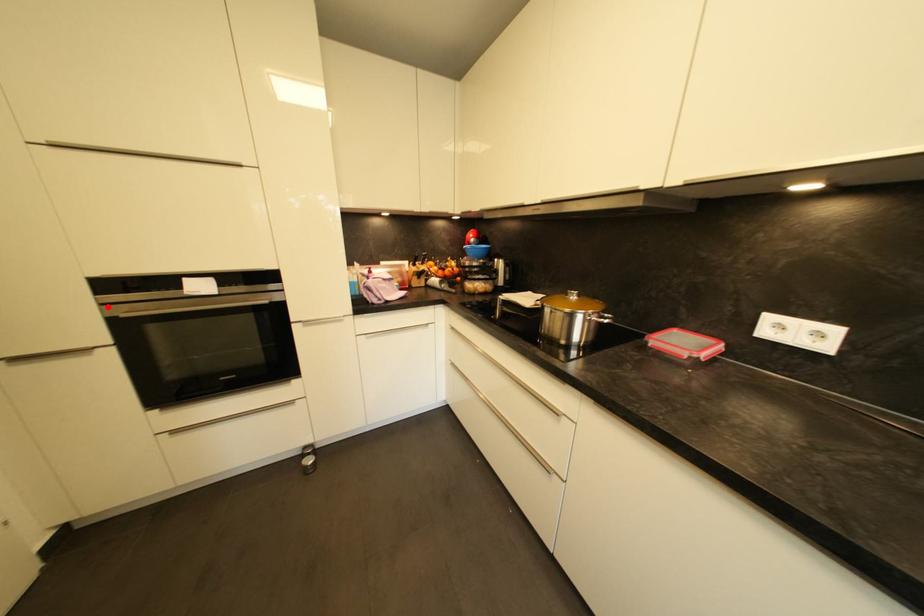
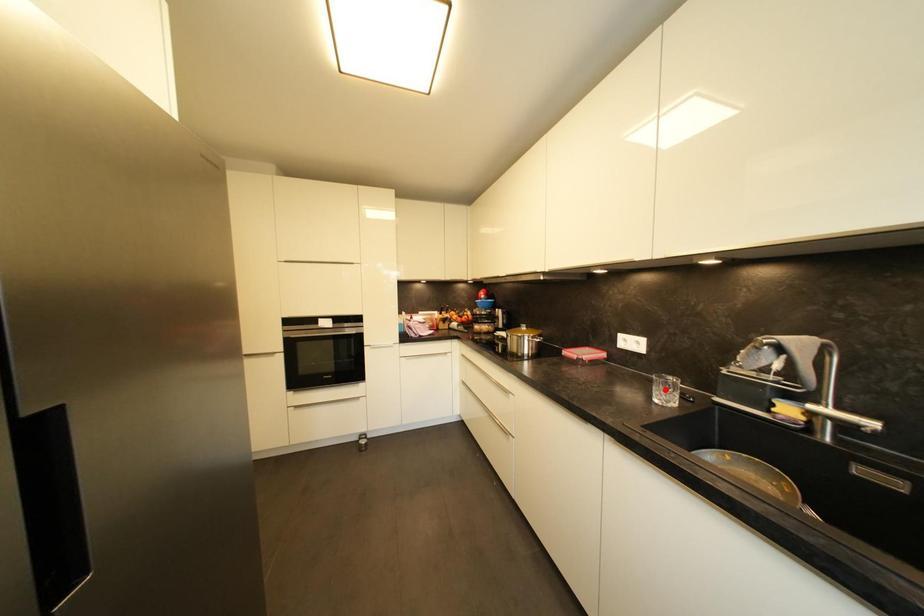
Consider the image. I am providing you with two images of the same scene from different viewpoints. A red point is marked on the first image and another point is marked on the second image. Is the marked point in image1 the same physical position as the marked point in image2?

No